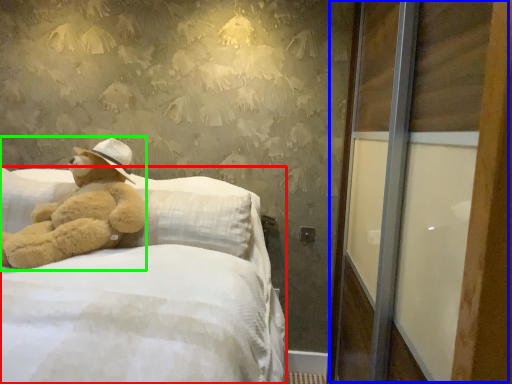
Question: Based on their relative distances, which object is farther from bed (highlighted by a red box)? Choose from screen door (highlighted by a blue box) and teddy bear (highlighted by a green box).

Choices:
 (A) screen door
 (B) teddy bear

Answer: (A)